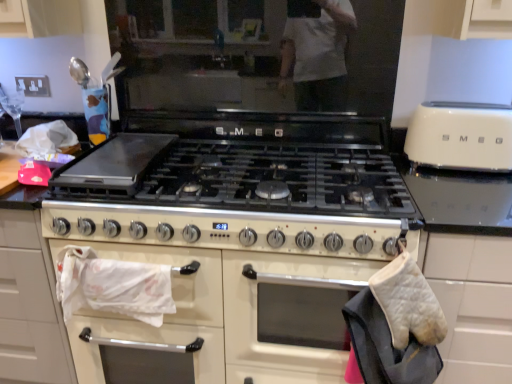
Question: Is ivory matte toaster at right wider or thinner than white quilted oven mitt at right?

Choices:
 (A) wide
 (B) thin

Answer: (A)

Question: Considering the relative positions of ivory matte toaster at right and white quilted oven mitt at right in the image provided, is ivory matte toaster at right to the left or to the right of white quilted oven mitt at right?

Choices:
 (A) left
 (B) right

Answer: (B)

Question: Which object is the farthest from the white quilted oven mitt at right?

Choices:
 (A) ivory matte toaster at right
 (B) white glossy oven at center

Answer: (A)

Question: Which is farther from the white glossy oven at center?

Choices:
 (A) white quilted oven mitt at right
 (B) ivory matte toaster at right

Answer: (B)